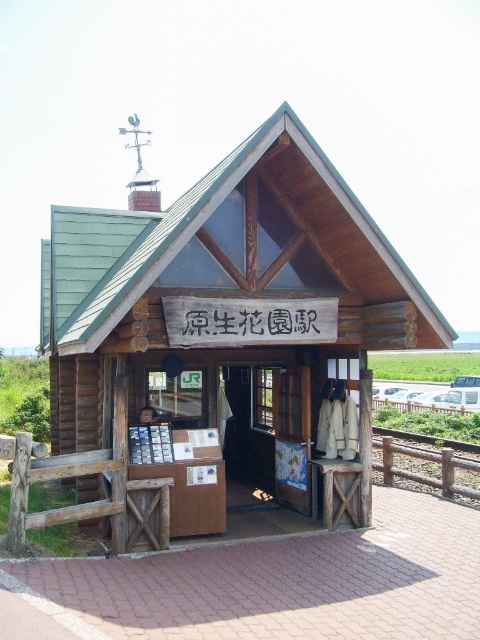
Which of these two, wooden cabin at center or wooden signboard at center, stands shorter?

wooden cabin at center

At what (x,y) coordinates should I click in order to perform the action: click on wooden cabin at center. Please return your answer as a coordinate pair (x, y). The height and width of the screenshot is (640, 480). Looking at the image, I should click on (224, 298).

The height and width of the screenshot is (640, 480). Identify the location of wooden cabin at center. (224, 298).

Can you confirm if wooden sign at center is bigger than wooden signboard at center?

No.

Identify the location of wooden sign at center. (260, 321).

Can you confirm if wooden cabin at center is positioned above wooden sign at center?

No, wooden cabin at center is not above wooden sign at center.

Which is more to the left, wooden cabin at center or wooden sign at center?

wooden sign at center

Who is more distant from viewer, (186, 193) or (229, 323)?

The point (186, 193) is more distant.

Identify the location of wooden cabin at center. (224, 298).